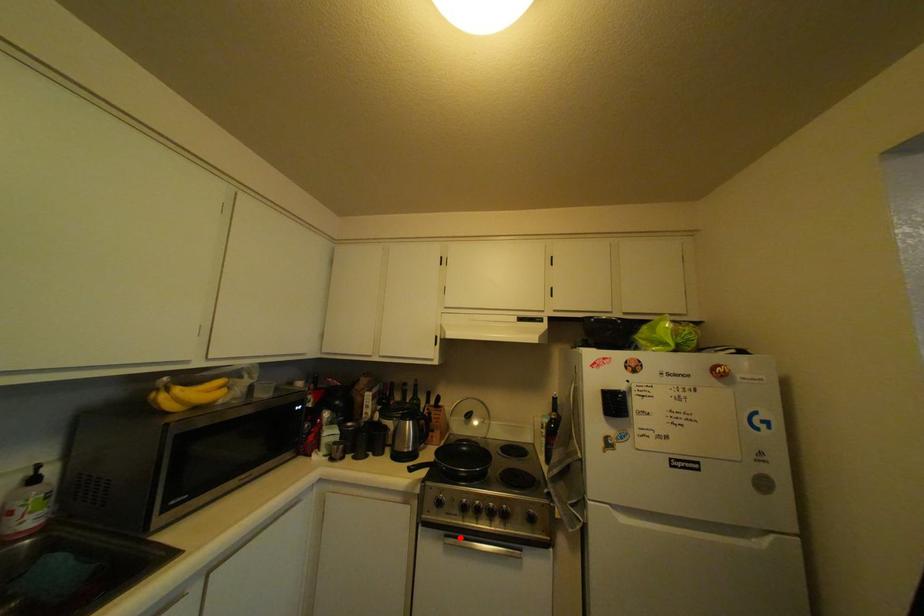
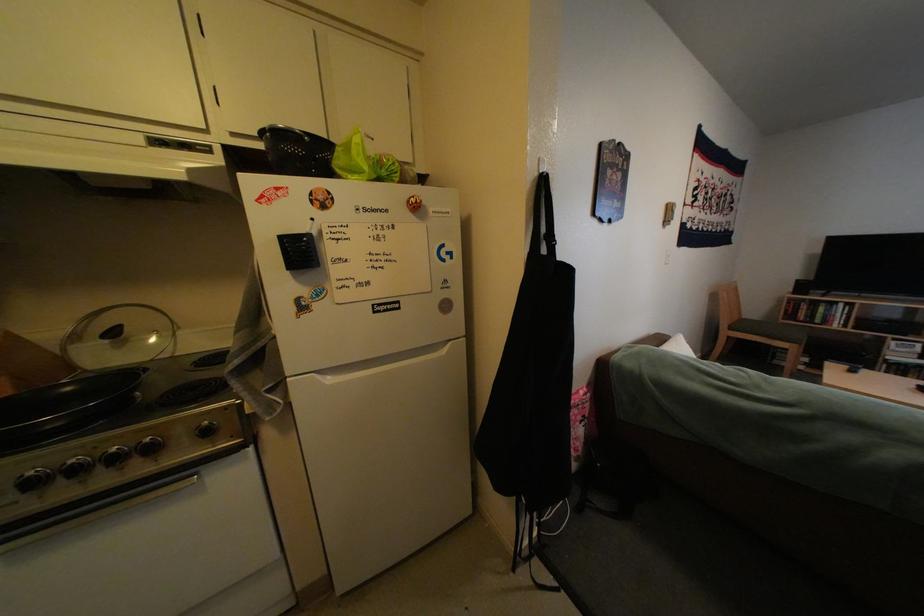
Find the pixel in the second image that matches the highlighted location in the first image.

(10, 546)